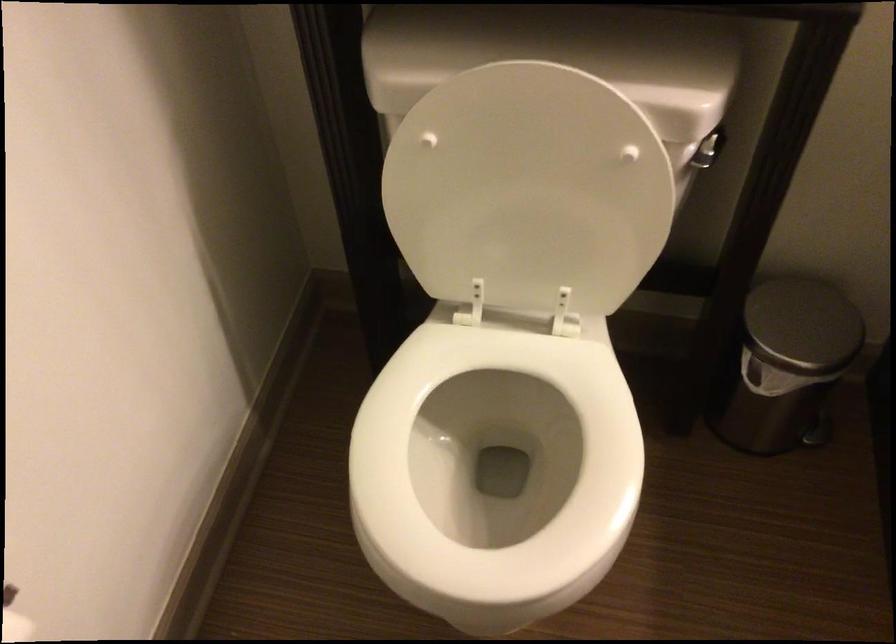
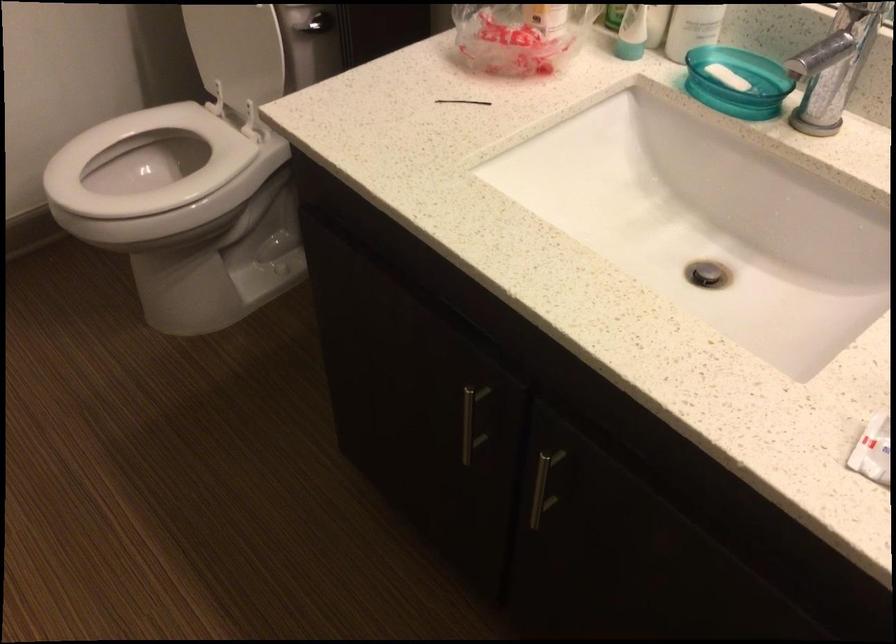
Find the pixel in the second image that matches pixel 543 234 in the first image.

(237, 51)